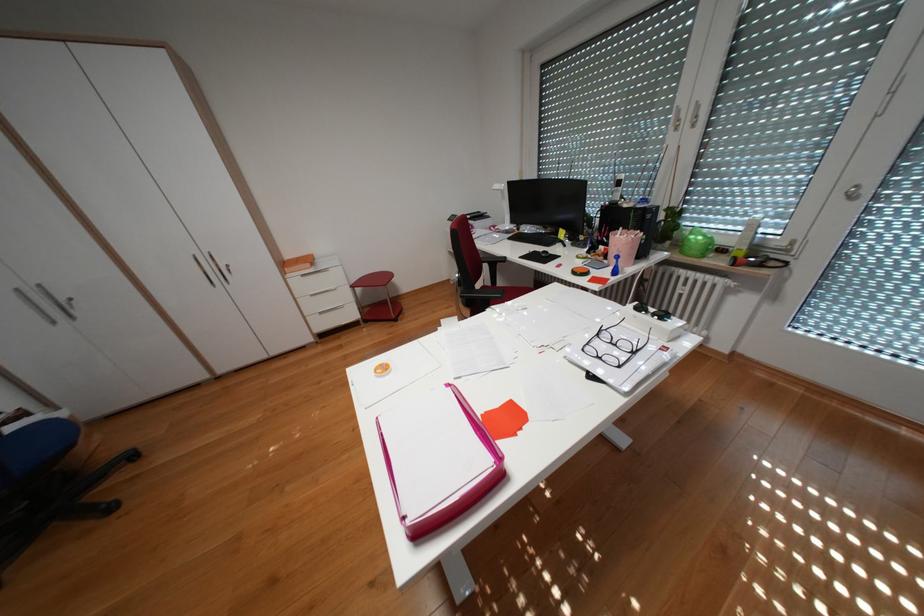
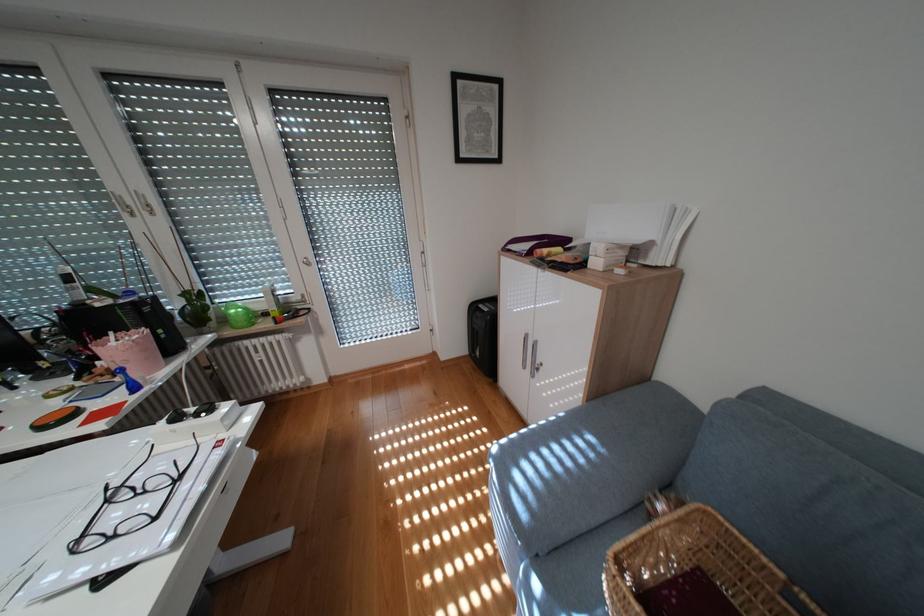
The point at (635, 238) is marked in the first image. Where is the corresponding point in the second image?

(136, 345)